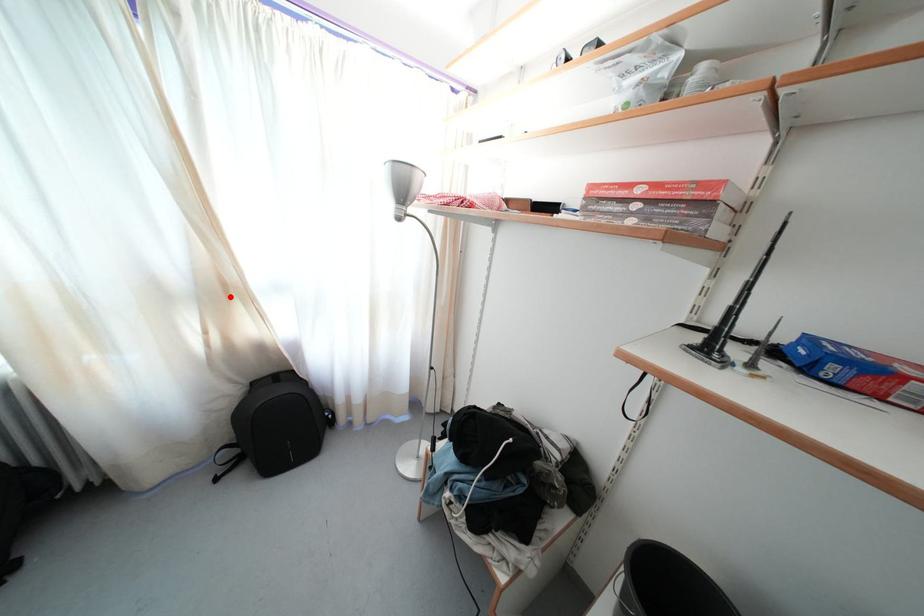
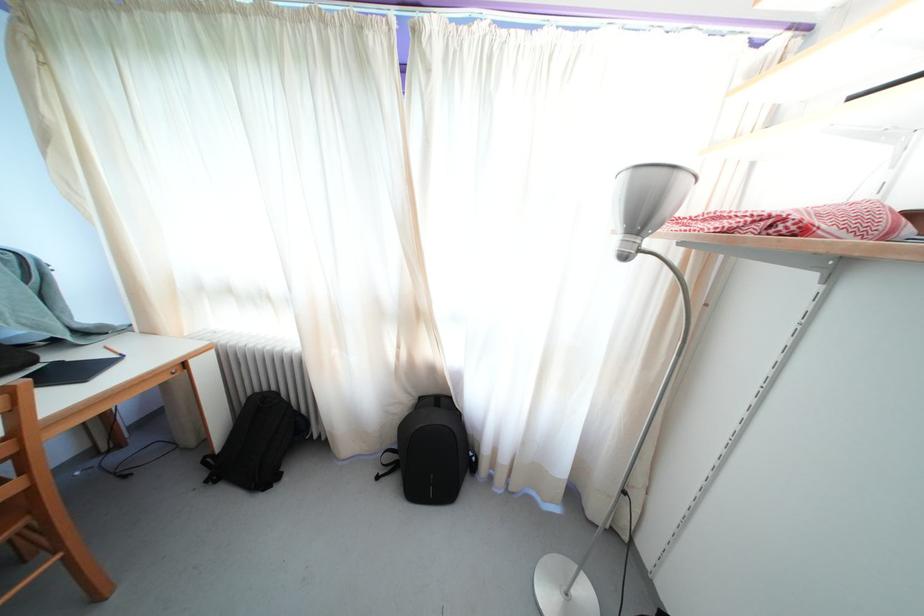
Where in the second image is the point corresponding to the highlighted location from the first image?

(421, 321)